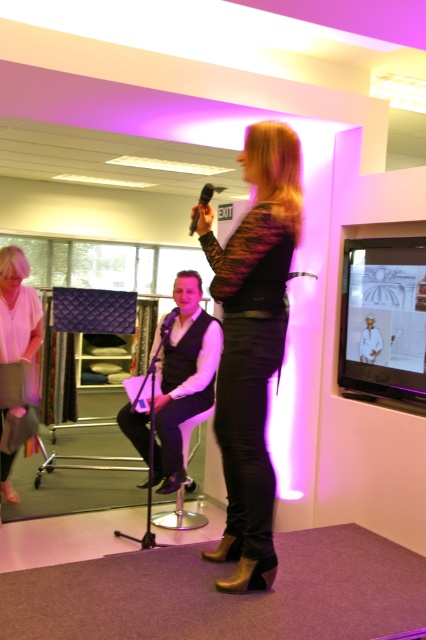
Question: Is matte white blouse at center wider than black matte microphone at center?

Choices:
 (A) no
 (B) yes

Answer: (B)

Question: Is orange matte microphone at upper center bigger than black matte microphone at center?

Choices:
 (A) no
 (B) yes

Answer: (A)

Question: Which object is closer to the camera taking this photo?

Choices:
 (A) black matte microphone at center
 (B) matte white blouse at center
 (C) orange matte microphone at upper center

Answer: (C)

Question: Can you confirm if orange matte microphone at upper center is positioned to the left of black matte microphone at center?

Choices:
 (A) yes
 (B) no

Answer: (B)

Question: Which object appears closest to the camera in this image?

Choices:
 (A) matte white blouse at center
 (B) matte black vest at center

Answer: (A)

Question: Which point is closer to the camera?

Choices:
 (A) (172, 308)
 (B) (204, 204)

Answer: (B)